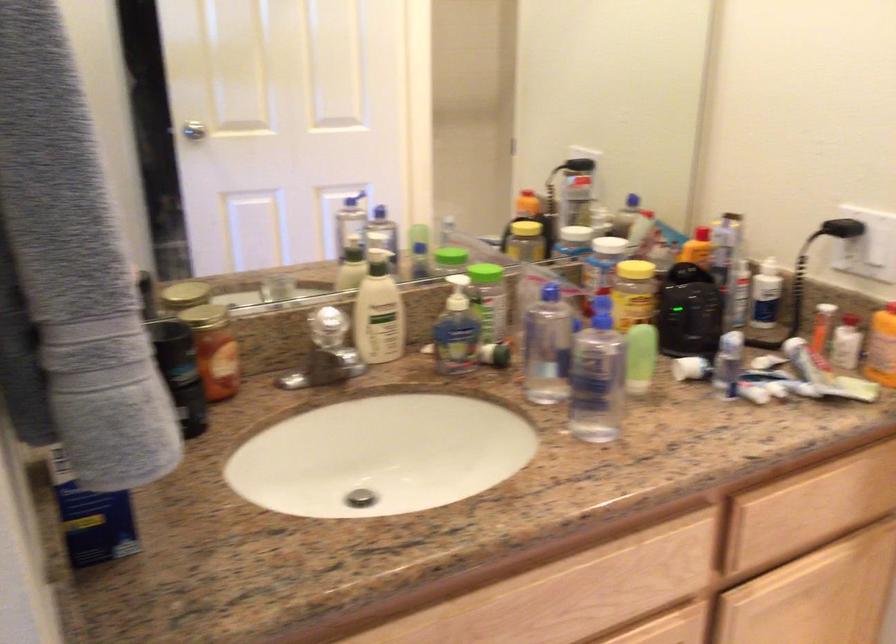
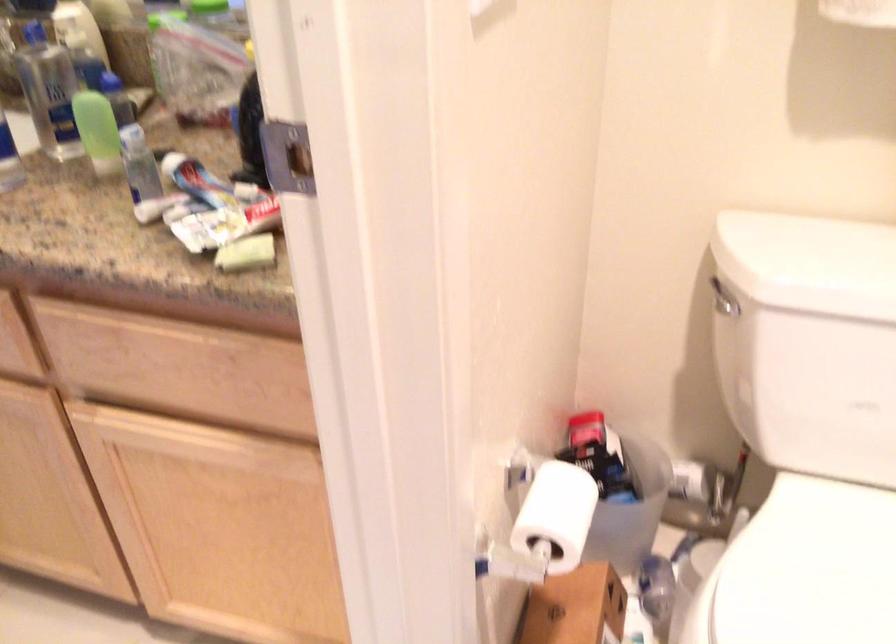
Locate, in the second image, the point that corresponds to point (707, 375) in the first image.

(197, 182)